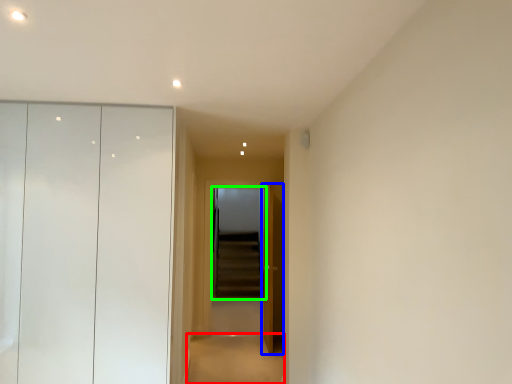
Question: Based on their relative distances, which object is farther from path (highlighted by a red box)? Choose from door (highlighted by a blue box) and screen door (highlighted by a green box).

Choices:
 (A) door
 (B) screen door

Answer: (B)